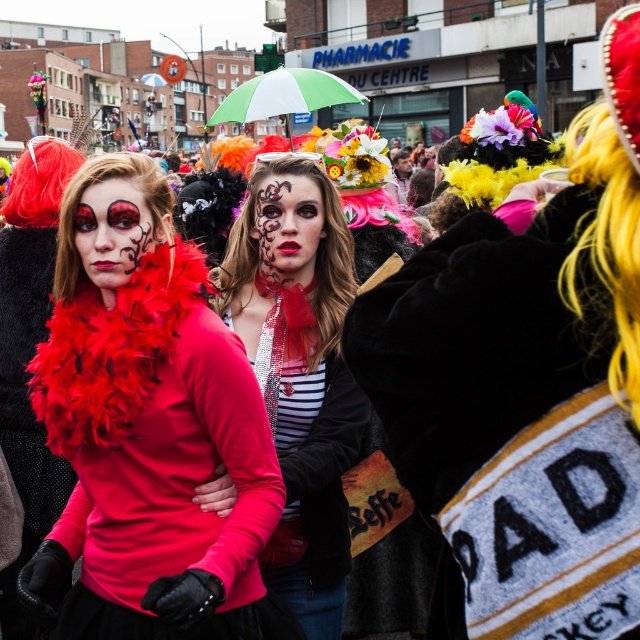
Is matte red scarf at center above green and white striped umbrella at center?

No, matte red scarf at center is not above green and white striped umbrella at center.

Where is `matte red scarf at center`? matte red scarf at center is located at coordinates (113, 232).

At what (x,y) coordinates should I click in order to perform the action: click on matte red scarf at center. Please return your answer as a coordinate pair (x, y). Looking at the image, I should click on (113, 232).

Identify the location of matte red scarf at center. This screenshot has height=640, width=640. (113, 232).

Who is lower down, matte red feather boa at center or matte black dress at center?

matte red feather boa at center

Can you confirm if matte red feather boa at center is positioned below matte black dress at center?

Correct, matte red feather boa at center is located below matte black dress at center.

Where is `matte red feather boa at center`? This screenshot has height=640, width=640. matte red feather boa at center is located at coordinates (147, 429).

Is matte red feather boa at center above matte red scarf at center?

Incorrect, matte red feather boa at center is not positioned above matte red scarf at center.

Based on the photo, who is higher up, matte red feather boa at center or matte red scarf at center?

matte red scarf at center

Between point (138, 609) and point (138, 227), which one is positioned in front?

Point (138, 609) is more forward.

Locate an element on the screen. The image size is (640, 640). matte red feather boa at center is located at coordinates (147, 429).